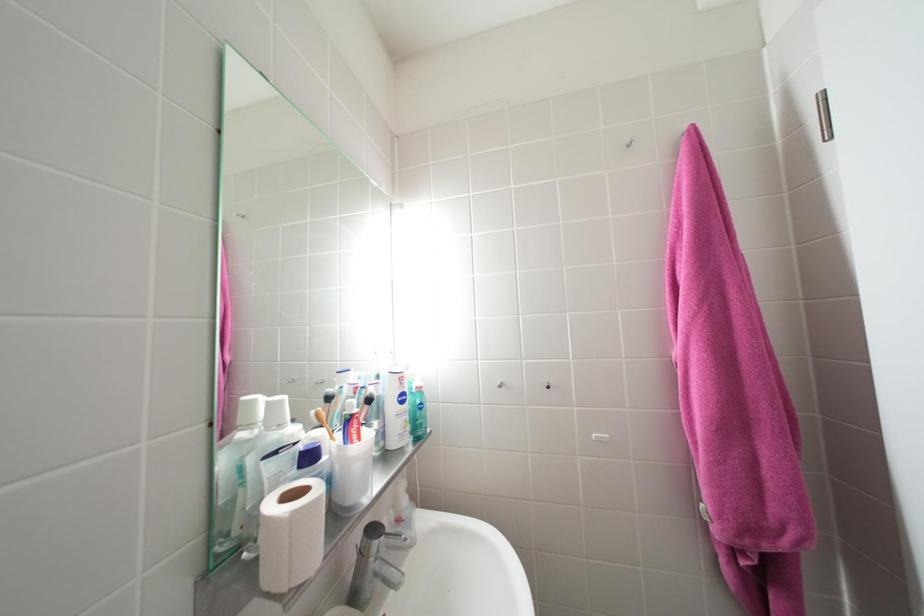
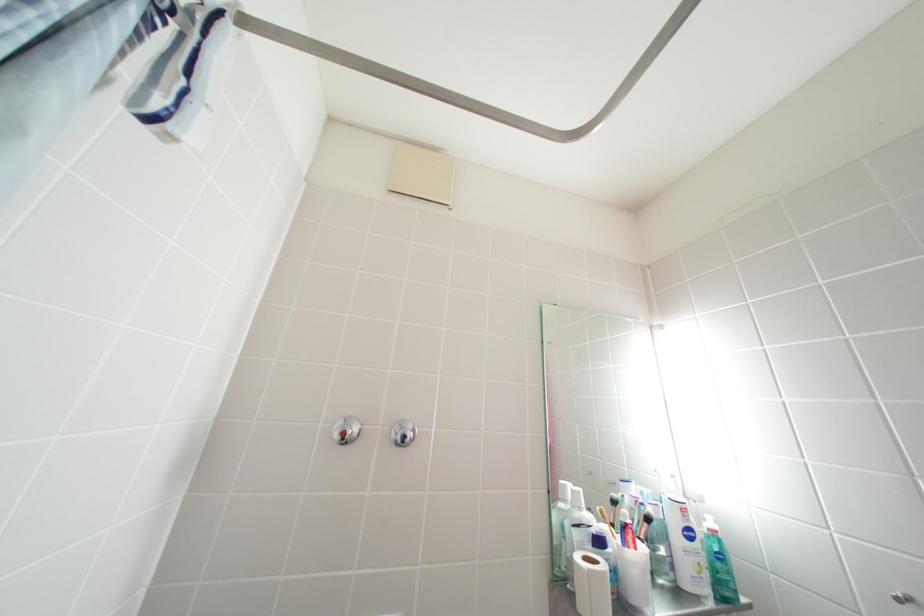
Based on the photo, the images are taken continuously from a first-person perspective. In which direction is your viewpoint rotating?

The camera's rotation is toward left-up.